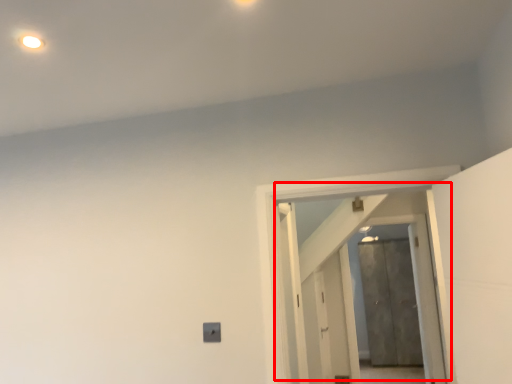
Question: In this image, where is door (annotated by the red box) located relative to door?

Choices:
 (A) left
 (B) right

Answer: (A)